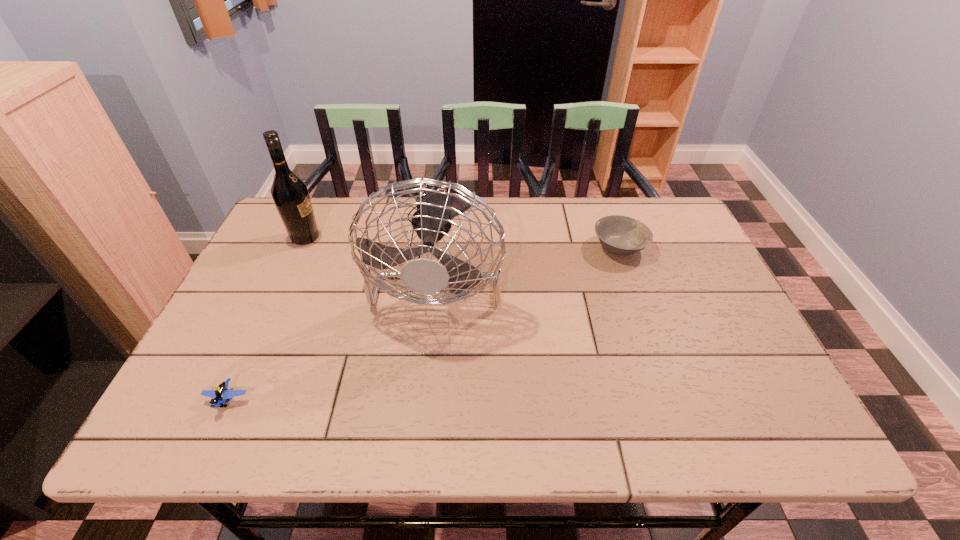
I want to click on the second object from right to left, so click(x=432, y=221).

Where is `wine bottle`? wine bottle is located at coordinates (290, 194).

Image resolution: width=960 pixels, height=540 pixels. I want to click on bowl, so click(621, 235).

Where is `Lego`? The height and width of the screenshot is (540, 960). Lego is located at coordinates (222, 392).

The image size is (960, 540). I want to click on vacant space located on the front-facing side of the fan, so click(426, 395).

Where is `vacant space located 0.280m on the label of the wine bottle`? Image resolution: width=960 pixels, height=540 pixels. vacant space located 0.280m on the label of the wine bottle is located at coordinates (416, 238).

I want to click on vacant space located 0.100m on the back of the rightmost object, so click(x=607, y=211).

Locate an element on the screen. This screenshot has width=960, height=540. fan located at the far edge is located at coordinates (432, 221).

At what (x,y) coordinates should I click in order to perform the action: click on wine bottle that is at the far edge. Please return your answer as a coordinate pair (x, y). Looking at the image, I should click on (290, 194).

Where is `bowl at the far edge`? This screenshot has height=540, width=960. bowl at the far edge is located at coordinates point(621,235).